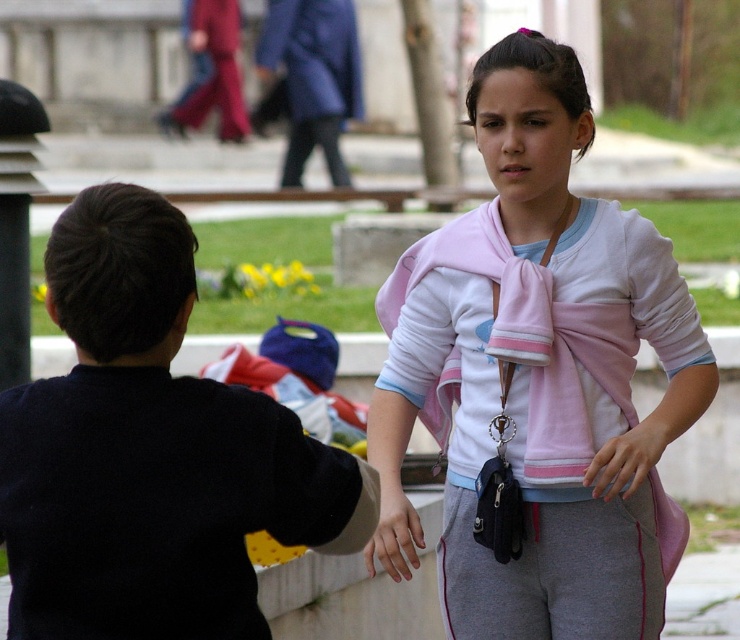
You are a photographer trying to capture a closeup of the pink fabric scarf at center and the blue cotton sweatshirt at upper center. Which object should you focus on first if you want to ensure both are in focus without moving the camera?

The blue cotton sweatshirt at upper center should be focused on first because it is closer to the camera than the pink fabric scarf at center, ensuring both will be in focus when focusing on the closer object.